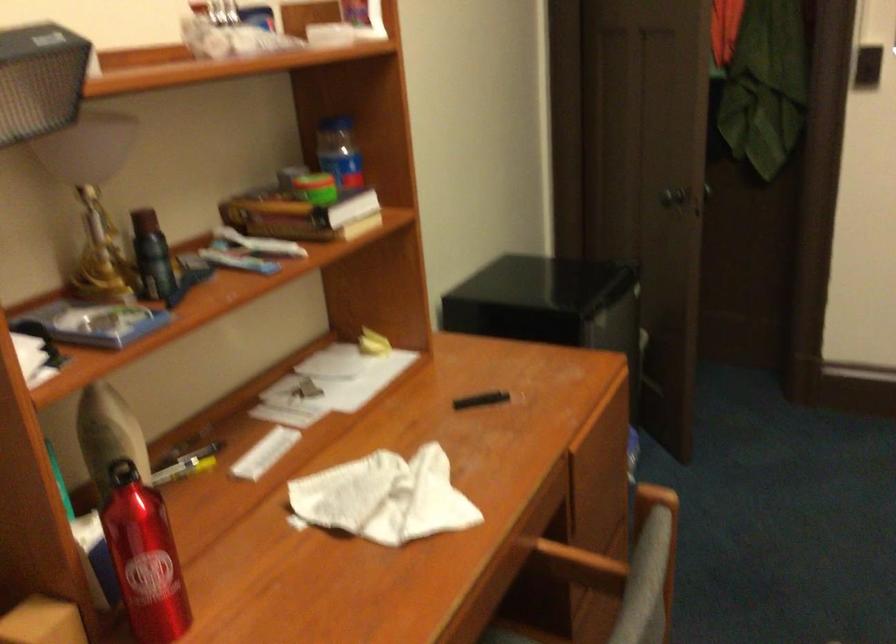
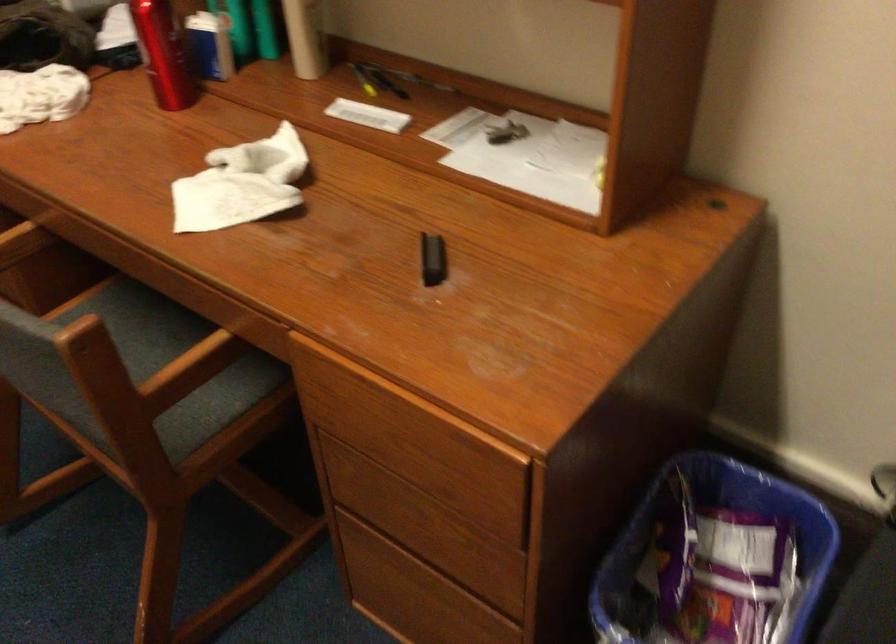
Locate, in the second image, the point that corresponds to [300,393] in the first image.

(504, 131)